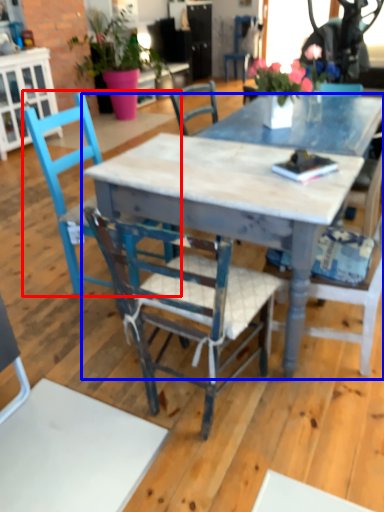
Question: Which object appears farthest to the camera in this image, chair (highlighted by a red box) or desk (highlighted by a blue box)?

Choices:
 (A) chair
 (B) desk

Answer: (A)